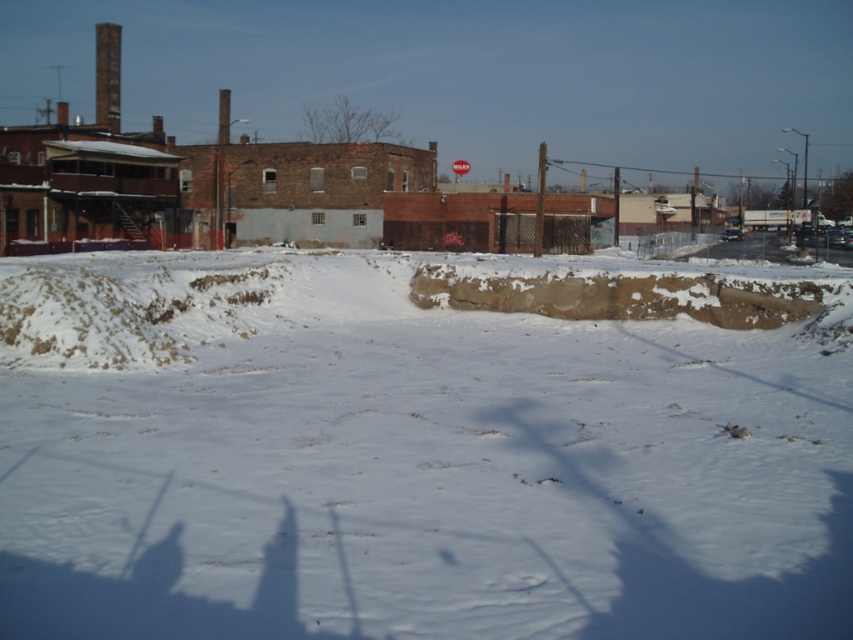
Question: Is white powdery snow at center smaller than red plastic sign at upper center?

Choices:
 (A) yes
 (B) no

Answer: (A)

Question: Which point is closer to the camera?

Choices:
 (A) white powdery snow at center
 (B) red plastic sign at upper center

Answer: (A)

Question: Can you confirm if white powdery snow at center is bigger than red plastic sign at upper center?

Choices:
 (A) yes
 (B) no

Answer: (B)

Question: Which of the following is the closest to the observer?

Choices:
 (A) brown dirt mound at center
 (B) red plastic sign at upper center

Answer: (A)

Question: Which point is closer to the camera?

Choices:
 (A) (457, 163)
 (B) (776, 300)

Answer: (B)

Question: In this image, where is white powdery snow at center located relative to brown dirt mound at center?

Choices:
 (A) left
 (B) right

Answer: (A)